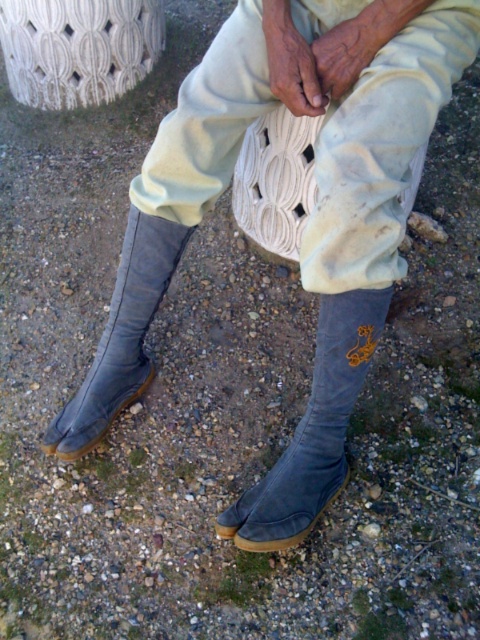
Based on the photo, is suede gray tabi at center positioned at the back of gray suede tabi at lower left?

No, it is not.

Between point (310, 476) and point (156, 253), which one is positioned behind?

Positioned behind is point (156, 253).

Does point (294, 522) come in front of point (152, 237)?

Yes.

Where is `suede gray tabi at center`? This screenshot has height=640, width=480. suede gray tabi at center is located at coordinates (312, 429).